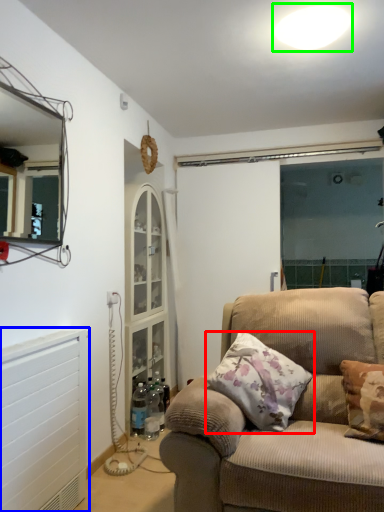
Question: Estimate the real-world distances between objects in this image. Which object is farther from pillow (highlighted by a red box), radiator (highlighted by a blue box) or light (highlighted by a green box)?

Choices:
 (A) radiator
 (B) light

Answer: (B)